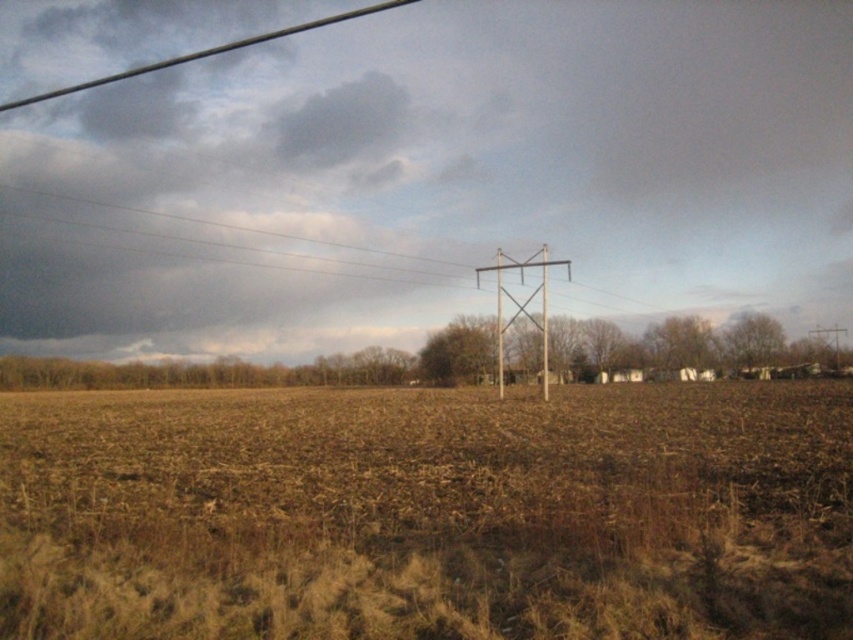
You are standing in the middle of a harvested field and see a point marked at coordinates (x=428, y=515). What is located at that point?

The brown grass at center is located at point (x=428, y=515).